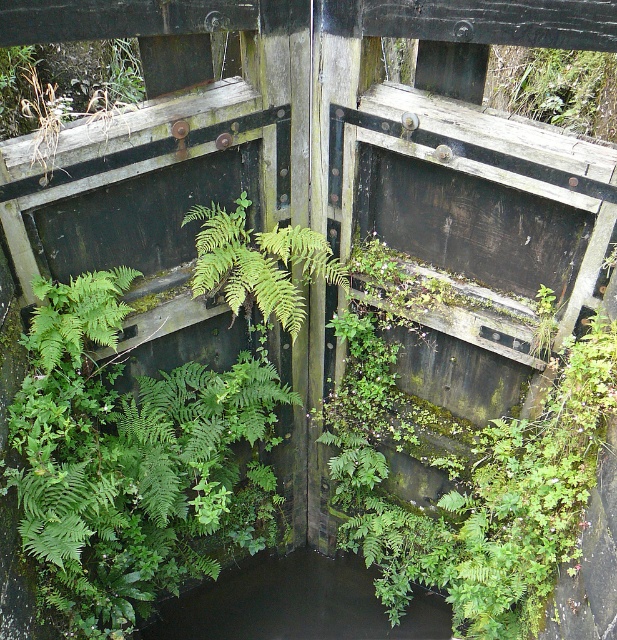
Question: Is the position of dark liquid water at center less distant than that of green leafy fern at center?

Choices:
 (A) no
 (B) yes

Answer: (A)

Question: Where is green leafy fern at center located in relation to green leafy plant at upper center in the image?

Choices:
 (A) above
 (B) below

Answer: (B)

Question: Which object is positioned closest to the dark liquid water at center?

Choices:
 (A) green leafy fern at center
 (B) green leafy plant at upper center
 (C) green leafy fern at left

Answer: (A)

Question: Which point is closer to the camera?

Choices:
 (A) green leafy plant at upper center
 (B) green leafy fern at center
 (C) dark liquid water at center
 (D) green leafy fern at left

Answer: (D)

Question: Is green leafy fern at center closer to camera compared to green leafy plant at upper center?

Choices:
 (A) no
 (B) yes

Answer: (B)

Question: Which point appears farthest from the camera in this image?

Choices:
 (A) (228, 253)
 (B) (280, 634)
 (C) (513, 61)

Answer: (B)